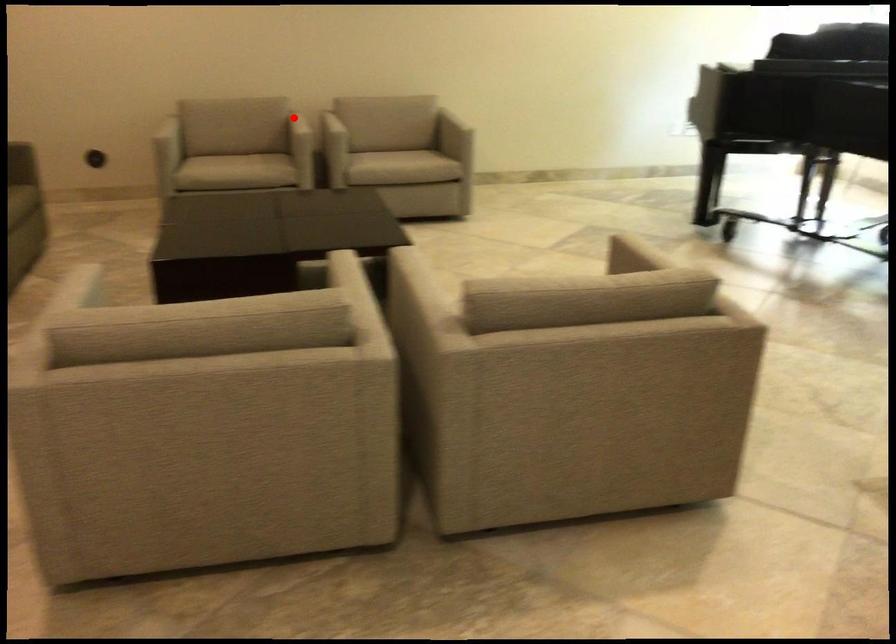
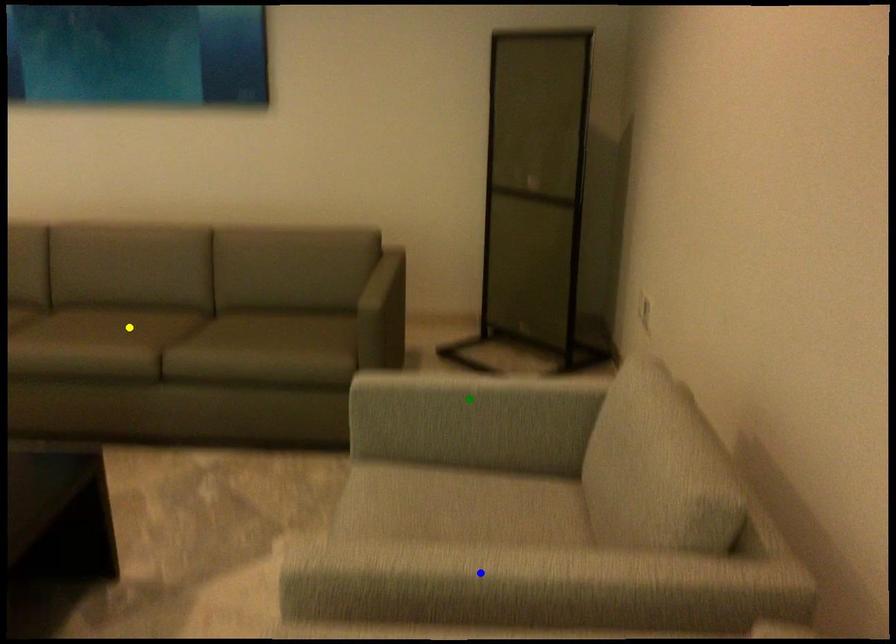
Question: I am providing you with two images of the same scene from different viewpoints. A red point is marked on the first image. You are given multiple points on the second image. Can you choose the point in image 2 that corresponds to the point in image 1?

Choices:
 (A) green point
 (B) yellow point
 (C) blue point

Answer: (C)